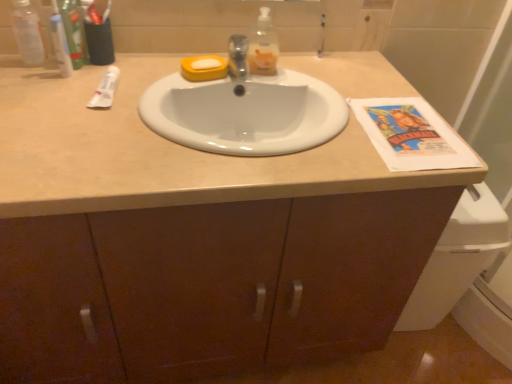
Image resolution: width=512 pixels, height=384 pixels. Find the location of `vacant point to the right of translucent plastic toothbrush holder at upper left, positioned as the second toiletry in left-to-right order`. vacant point to the right of translucent plastic toothbrush holder at upper left, positioned as the second toiletry in left-to-right order is located at coordinates (151, 68).